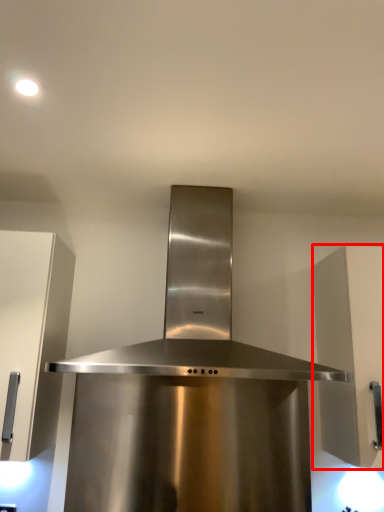
Question: From the image, what is the correct spatial relationship of cabinetry (annotated by the red box) in relation to home appliance?

Choices:
 (A) left
 (B) right

Answer: (B)